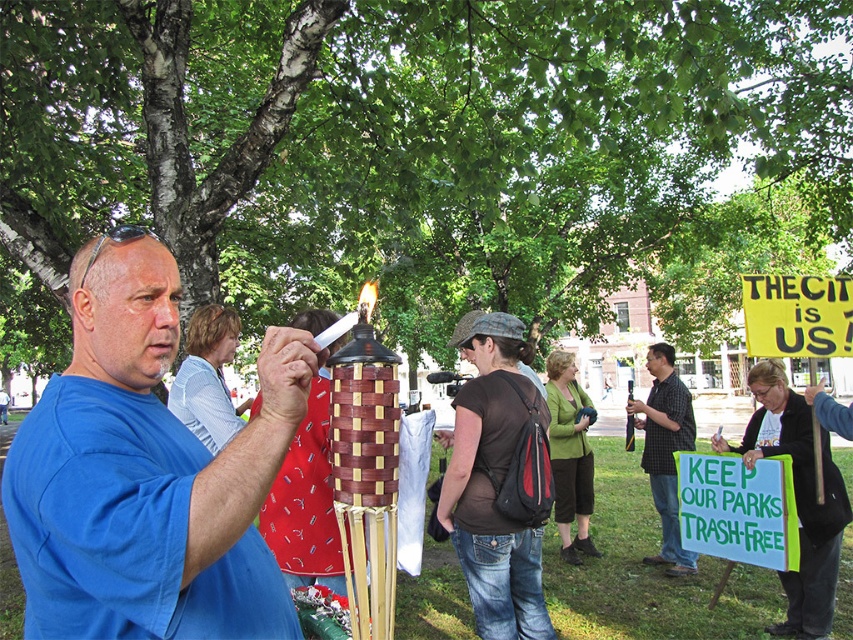
Between blue woven basket at center and checkered fabric shirt at center, which one has more height?

With more height is checkered fabric shirt at center.

At what (x,y) coordinates should I click in order to perform the action: click on blue woven basket at center. Please return your answer as a coordinate pair (x, y). Image resolution: width=853 pixels, height=640 pixels. Looking at the image, I should click on (146, 474).

Find the location of a particular element. This screenshot has height=640, width=853. blue woven basket at center is located at coordinates coord(146,474).

The height and width of the screenshot is (640, 853). I want to click on blue woven basket at center, so click(146, 474).

Does brown fabric backpack at center appear over checkered fabric shirt at center?

Indeed, brown fabric backpack at center is positioned over checkered fabric shirt at center.

Where is `brown fabric backpack at center`? brown fabric backpack at center is located at coordinates (492, 483).

At what (x,y) coordinates should I click in order to perform the action: click on blue woven basket at center. Please return your answer as a coordinate pair (x, y). This screenshot has width=853, height=640. Looking at the image, I should click on (146, 474).

Does point (91, 326) come farther from viewer compared to point (508, 605)?

No, it is not.

I want to click on blue woven basket at center, so click(146, 474).